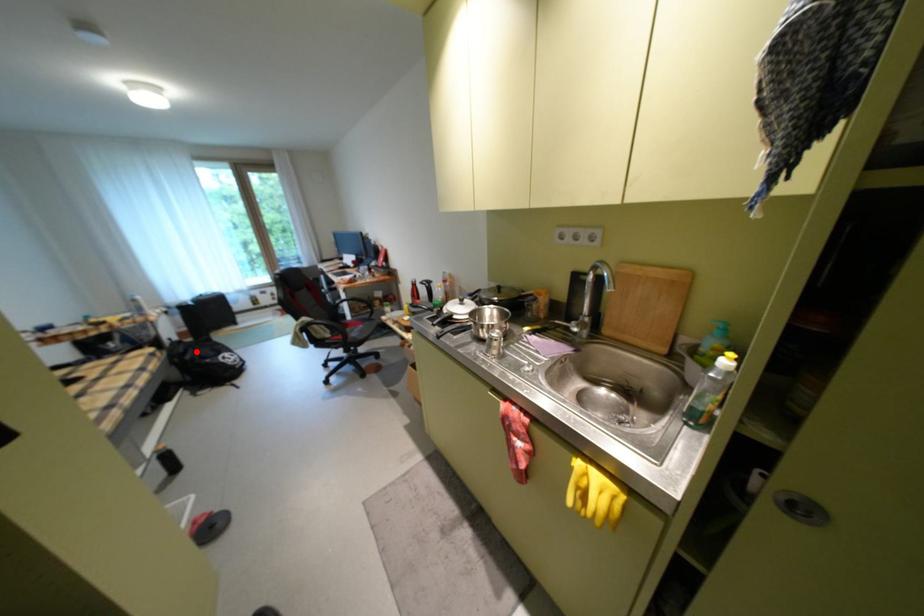
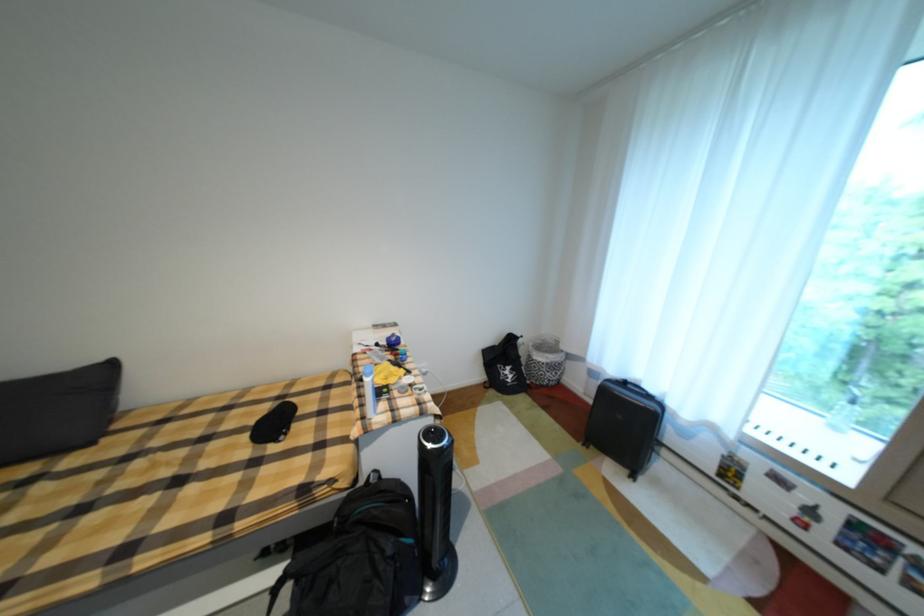
Question: I am providing you with two images of the same scene from different viewpoints. Image1 has a red point marked. In image2, the corresponding 3D location appears at what relative position? Reply with the corresponding letter.

Choices:
 (A) Closer
 (B) Farther

Answer: (B)